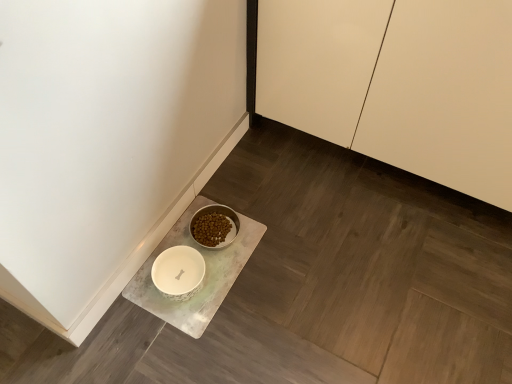
Identify the location of vacant space behind white marble tray at lower left. The height and width of the screenshot is (384, 512). (251, 180).